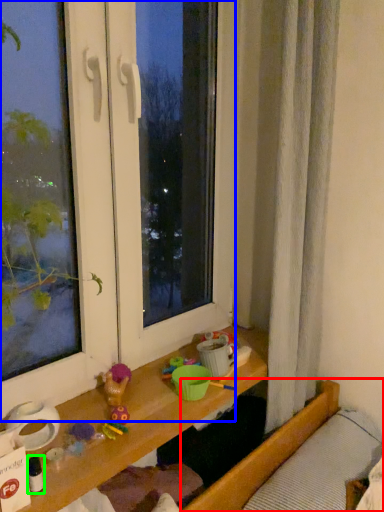
Question: Which object is the closest to the bed (highlighted by a red box)? Choose among these: window (highlighted by a blue box) or toy (highlighted by a green box).

Choices:
 (A) window
 (B) toy

Answer: (A)